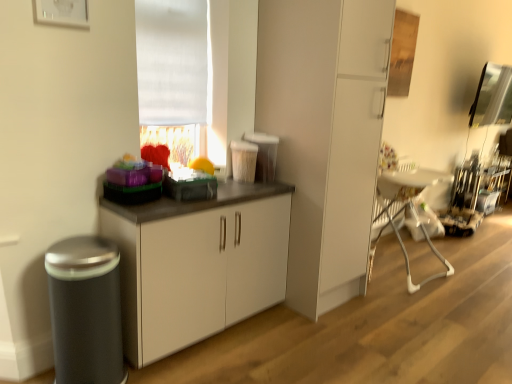
Locate an element on the screen. free location to the right of white matte cabinet at center, which is the 1th cabinetry in left-to-right order is located at coordinates (318, 339).